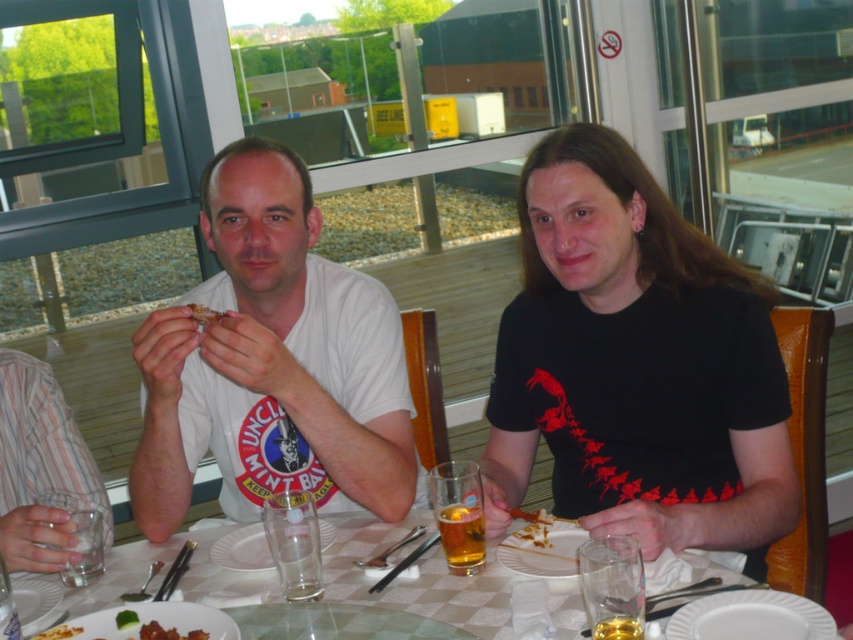
You are a waiter at a restaurant and need to place a new order at the table. The customer specified their dish should be placed exactly at point (x=751, y=618). Which object at the table corresponds to this coordinate?

A: The white ceramic plate at lower right is located at point (x=751, y=618).